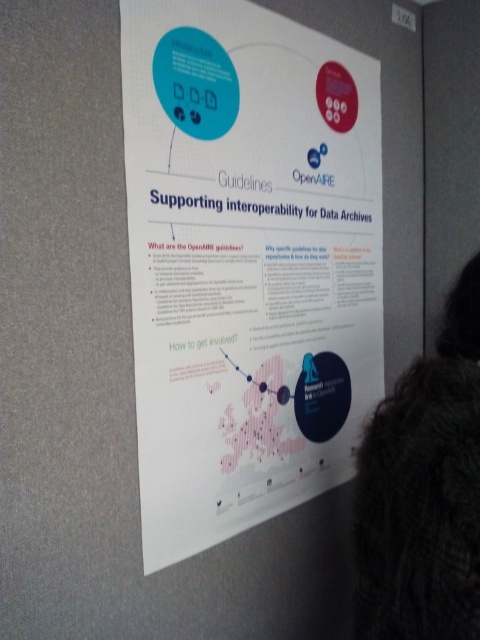
Question: Among these points, which one is farthest from the camera?

Choices:
 (A) (425, 579)
 (B) (160, 205)

Answer: (B)

Question: Can you confirm if white paper poster at center is positioned to the right of fuzzy brown fur at lower right?

Choices:
 (A) yes
 (B) no

Answer: (B)

Question: Can you confirm if white paper poster at center is bigger than fuzzy brown fur at lower right?

Choices:
 (A) no
 (B) yes

Answer: (B)

Question: Is white paper poster at center positioned in front of fuzzy brown fur at lower right?

Choices:
 (A) yes
 (B) no

Answer: (B)